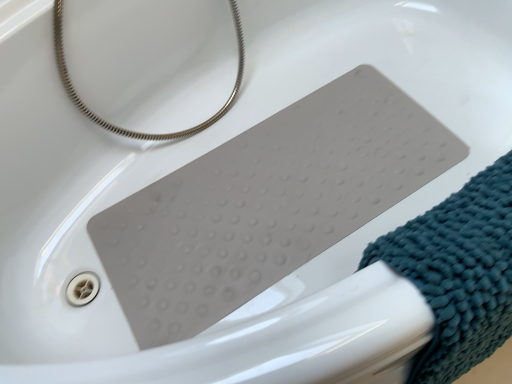
Question: From the image's perspective, relative to silver metallic hose at upper left, is teal textured towel at lower right above or below?

Choices:
 (A) below
 (B) above

Answer: (A)

Question: Considering the relative positions of teal textured towel at lower right and silver metallic hose at upper left in the image provided, is teal textured towel at lower right to the left or to the right of silver metallic hose at upper left?

Choices:
 (A) right
 (B) left

Answer: (A)

Question: Is point (419, 269) closer or farther from the camera than point (181, 130)?

Choices:
 (A) farther
 (B) closer

Answer: (B)

Question: From a real-world perspective, relative to teal textured towel at lower right, is silver metallic hose at upper left vertically above or below?

Choices:
 (A) below
 (B) above

Answer: (B)

Question: Is silver metallic hose at upper left bigger or smaller than teal textured towel at lower right?

Choices:
 (A) big
 (B) small

Answer: (A)

Question: Is point (172, 134) closer or farther from the camera than point (483, 357)?

Choices:
 (A) farther
 (B) closer

Answer: (A)

Question: Is silver metallic hose at upper left situated inside teal textured towel at lower right or outside?

Choices:
 (A) inside
 (B) outside

Answer: (B)